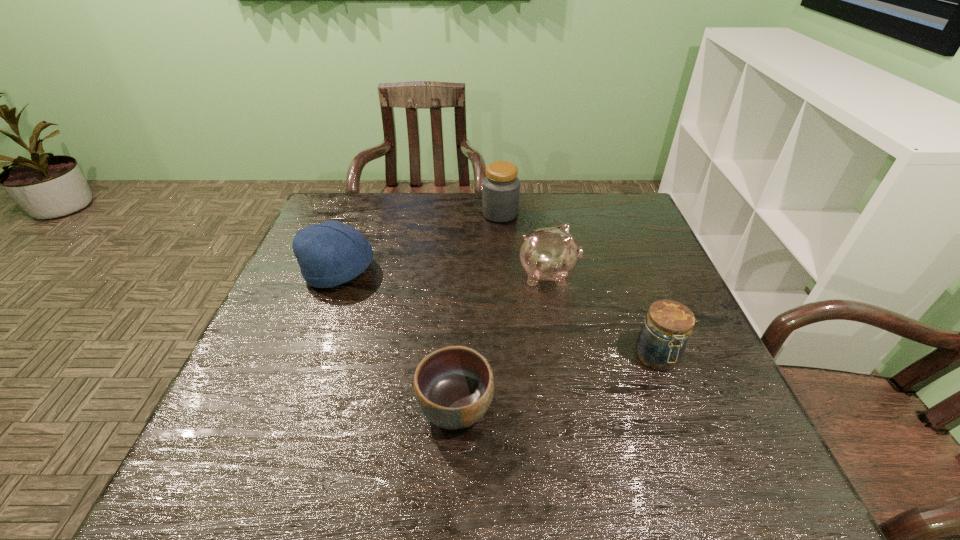
Identify the location of free location located 0.340m on the front of the skullcap. The width and height of the screenshot is (960, 540). (286, 413).

Locate an element on the screen. The height and width of the screenshot is (540, 960). free spot located 0.190m on the front facing side of the piggy bank is located at coordinates (649, 274).

Locate an element on the screen. vacant area located 0.150m on the lid of the nearer jar is located at coordinates (689, 443).

Find the location of a particular element. free space located on the back of the bowl is located at coordinates (461, 293).

Locate an element on the screen. object at the far edge is located at coordinates (500, 188).

Where is `object situated at the left edge`? This screenshot has width=960, height=540. object situated at the left edge is located at coordinates (329, 254).

Locate an element on the screen. The height and width of the screenshot is (540, 960). object at the right edge is located at coordinates (662, 340).

Locate an element on the screen. The height and width of the screenshot is (540, 960). free space at the far edge is located at coordinates (379, 219).

The width and height of the screenshot is (960, 540). In order to click on free space at the near edge in this screenshot , I will do `click(463, 497)`.

This screenshot has height=540, width=960. In order to click on free spot at the left edge of the desktop in this screenshot , I will do `click(232, 446)`.